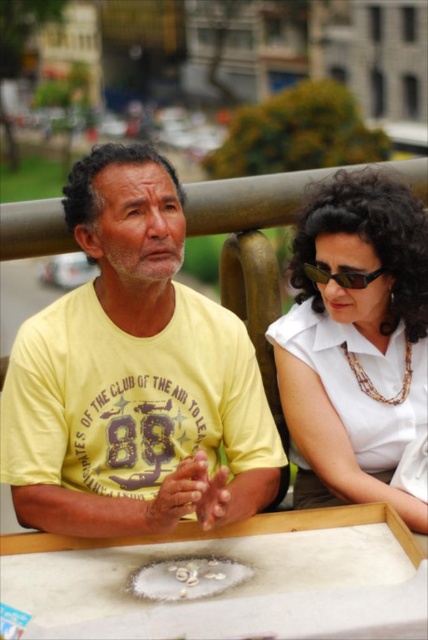
What is the exact location of the white glossy shirt at upper right in the image?

The white glossy shirt at upper right is located at point (356, 342).